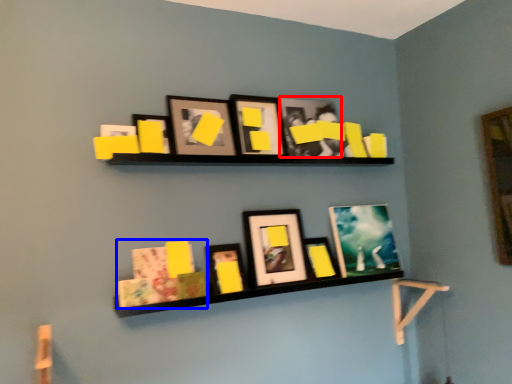
Question: Which point is closer to the camera, picture frame (highlighted by a red box) or book (highlighted by a blue box)?

Choices:
 (A) picture frame
 (B) book

Answer: (B)